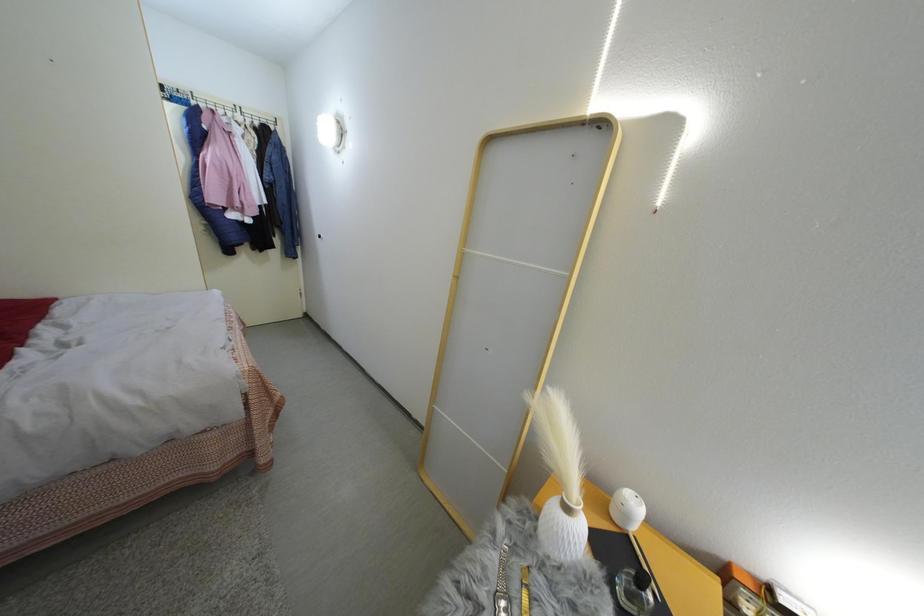
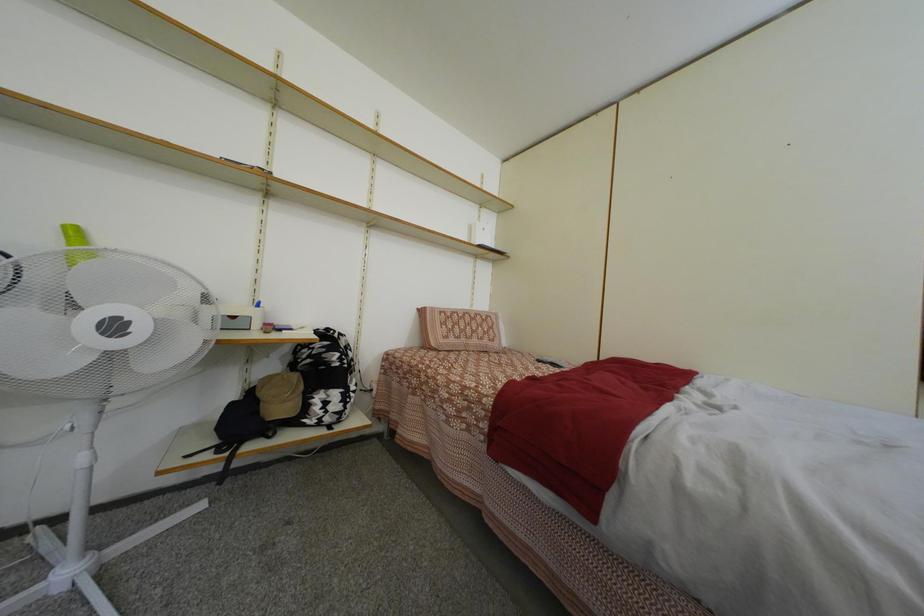
Question: Based on the continuous images, in which direction is the camera rotating? Reply with the corresponding letter.

Choices:
 (A) Left
 (B) Right
 (C) Up
 (D) Down

Answer: (A)